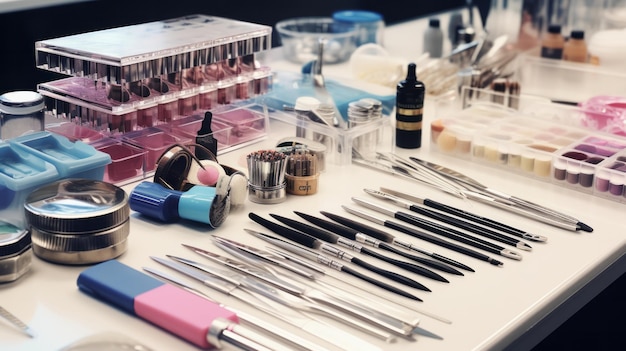
Where is `glass container`? This screenshot has height=351, width=626. glass container is located at coordinates (162, 64).